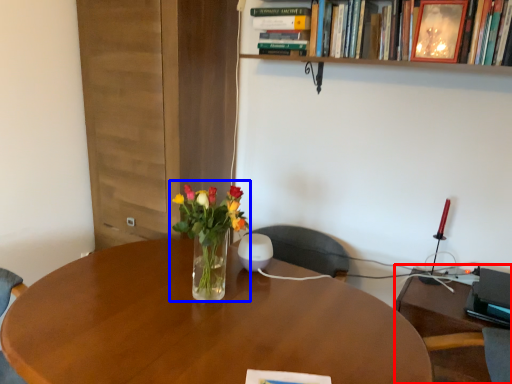
Question: Which object appears farthest to the camera in this image, computer desk (highlighted by a red box) or floral arrangement (highlighted by a blue box)?

Choices:
 (A) computer desk
 (B) floral arrangement

Answer: (A)